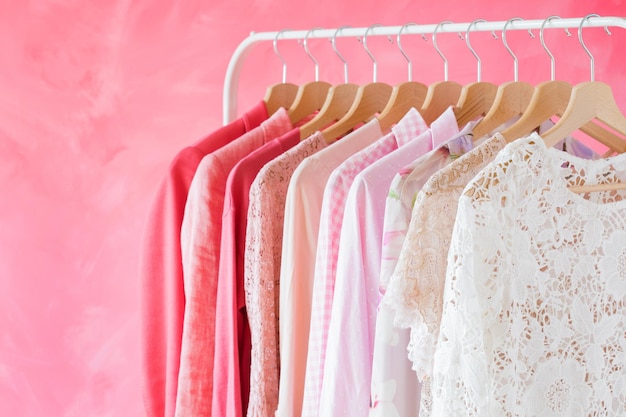
The image size is (626, 417). I want to click on stainless steel hanger hooks, so click(x=275, y=47), click(x=307, y=47), click(x=334, y=45), click(x=367, y=45), click(x=402, y=45), click(x=438, y=44), click(x=470, y=40), click(x=504, y=41), click(x=541, y=39), click(x=580, y=35).